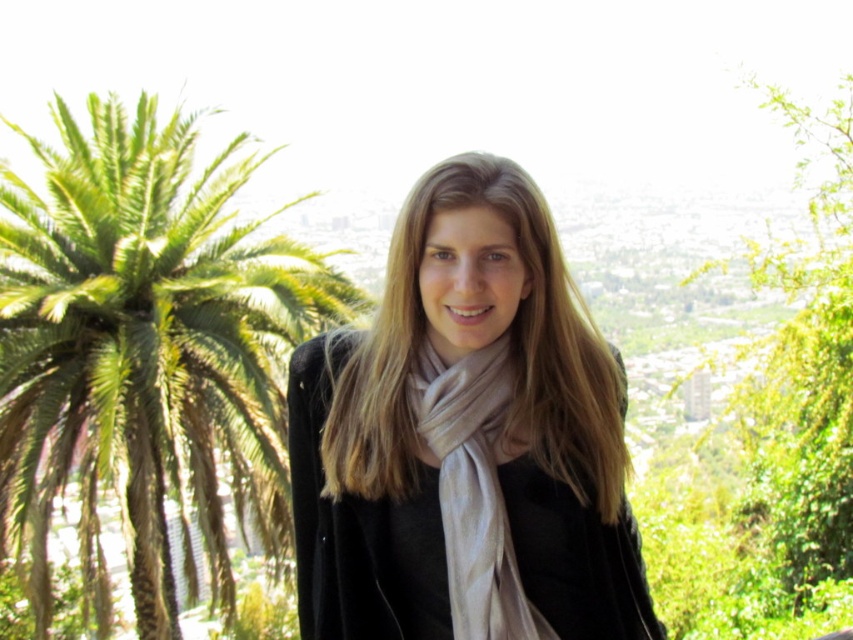
Does point (161, 168) come farther from viewer compared to point (502, 632)?

Yes, point (161, 168) is farther from viewer.

Does point (86, 442) come closer to viewer compared to point (534, 627)?

No.

Find the location of a particular element. This screenshot has width=853, height=640. green leafy palm tree at left is located at coordinates (144, 348).

Find the location of a particular element. matte black scarf at center is located at coordinates coord(465,438).

Is point (521, 554) positioned in front of point (416, 410)?

Yes, point (521, 554) is closer to viewer.

Does point (608, 388) lie behind point (527, 632)?

Yes, it is.

Where is `matte black scarf at center`? matte black scarf at center is located at coordinates click(x=465, y=438).

Does matte black scarf at center have a smaller size compared to green leafy palm tree at left?

Correct, matte black scarf at center occupies less space than green leafy palm tree at left.

Which is in front, point (492, 564) or point (56, 189)?

Positioned in front is point (56, 189).

I want to click on matte black scarf at center, so click(465, 438).